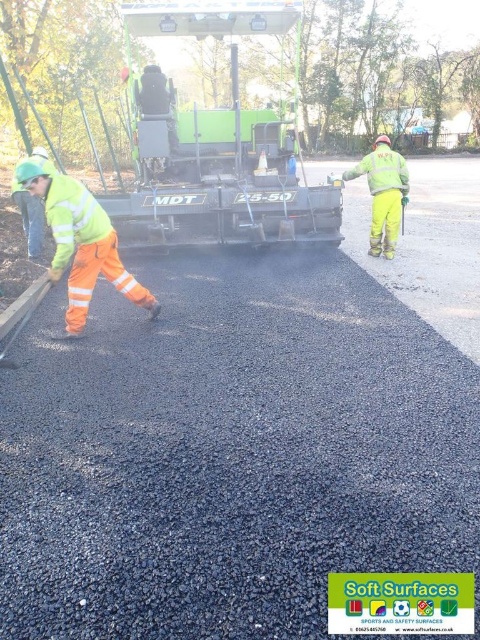
Question: Which object is positioned farthest from the high visibility reflective jacket at center?

Choices:
 (A) hi-visibility reflective jacket at left
 (B) green rubber asphalt spreader at center

Answer: (A)

Question: Does green rubber asphalt spreader at center appear on the right side of high visibility reflective jacket at center?

Choices:
 (A) yes
 (B) no

Answer: (B)

Question: Does hi-visibility reflective jacket at left appear on the left side of high visibility reflective jacket at center?

Choices:
 (A) yes
 (B) no

Answer: (A)

Question: Does hi-visibility reflective jacket at left have a lesser width compared to high visibility reflective jacket at center?

Choices:
 (A) no
 (B) yes

Answer: (B)

Question: Which of the following is the farthest from the observer?

Choices:
 (A) (371, 234)
 (B) (197, 115)

Answer: (B)

Question: Which point is farther from the camera taking this photo?

Choices:
 (A) (181, 220)
 (B) (388, 204)

Answer: (B)